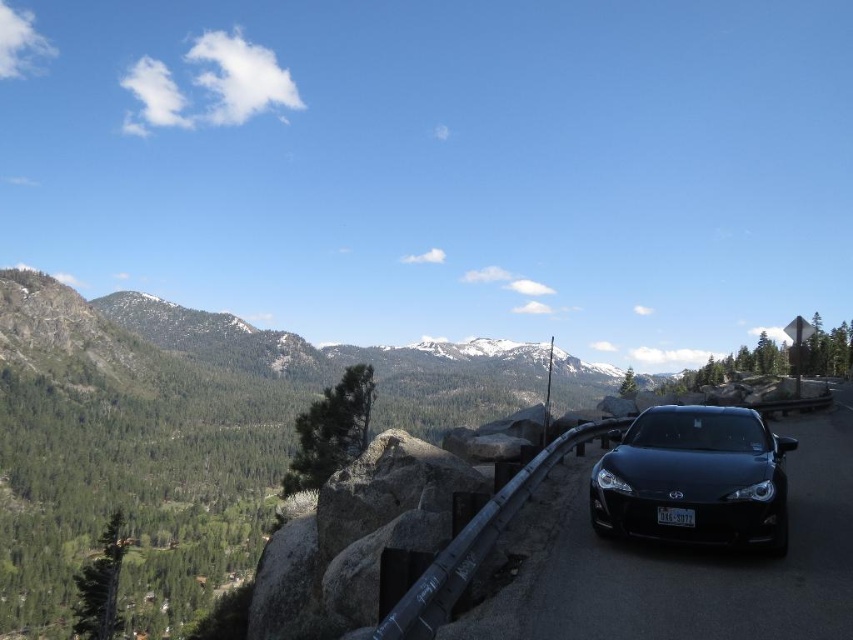
You are a photographer wanting to take a picture of the glossy black car at center and the white plastic license plate at center. Which object should you focus on first if you want both to be in sharp focus?

The glossy black car at center is in front of the white plastic license plate at center. Since the car is closer to the camera, focusing on it first would ensure both are in focus as the license plate is behind it.

You are a driver looking at the matte black car at center and the white plastic license plate at center. Which object is positioned more to the left?

The white plastic license plate at center is positioned more to the left than the matte black car at center.